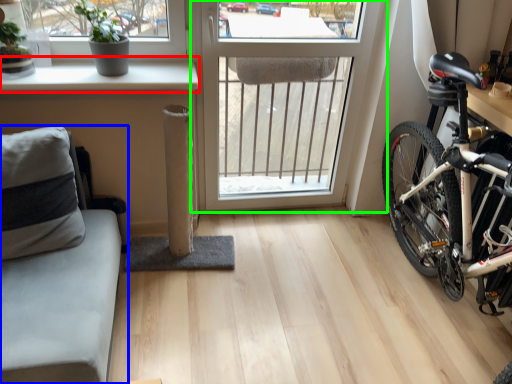
Question: Estimate the real-world distances between objects in this image. Which object is closer to window sill (highlighted by a red box), studio couch (highlighted by a blue box) or window (highlighted by a green box)?

Choices:
 (A) studio couch
 (B) window

Answer: (A)